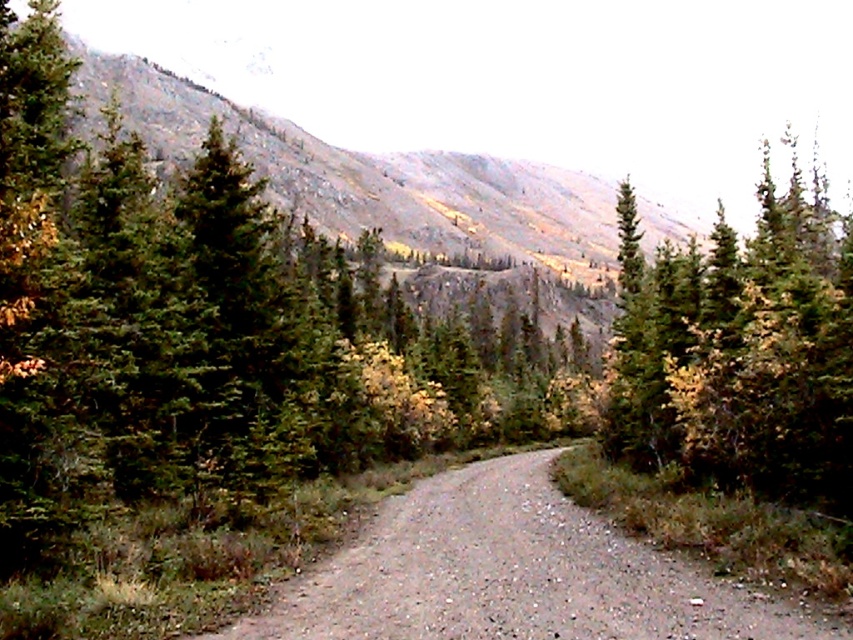
Consider the image. Between green matte tree at upper right and gray gravel trail at center, which one appears on the left side from the viewer's perspective?

From the viewer's perspective, gray gravel trail at center appears more on the left side.

Who is shorter, green matte tree at upper right or gray gravel trail at center?

With less height is gray gravel trail at center.

Locate an element on the screen. This screenshot has width=853, height=640. green matte tree at upper right is located at coordinates (741, 349).